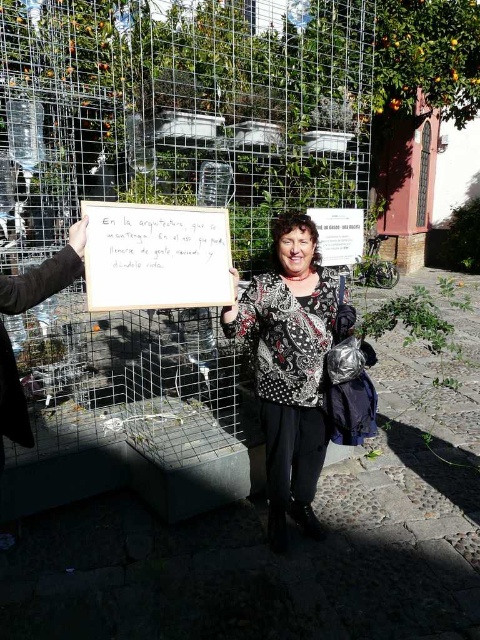
Question: In this image, where is wire mesh fence at center located relative to patterned fabric jacket at center?

Choices:
 (A) right
 (B) left

Answer: (B)

Question: Which is farther from the white paper at center?

Choices:
 (A) patterned fabric jacket at center
 (B) orange matte at upper right
 (C) wire mesh fence at center

Answer: (B)

Question: Is wire mesh fence at center wider than orange matte at upper right?

Choices:
 (A) yes
 (B) no

Answer: (B)

Question: Is wire mesh fence at center positioned behind patterned fabric jacket at center?

Choices:
 (A) no
 (B) yes

Answer: (B)

Question: Which object appears closest to the camera in this image?

Choices:
 (A) wire mesh fence at center
 (B) patterned fabric jacket at center
 (C) white paper at center
 (D) orange matte at upper right

Answer: (C)

Question: Which object appears closest to the camera in this image?

Choices:
 (A) white paper at center
 (B) wire mesh fence at center

Answer: (A)